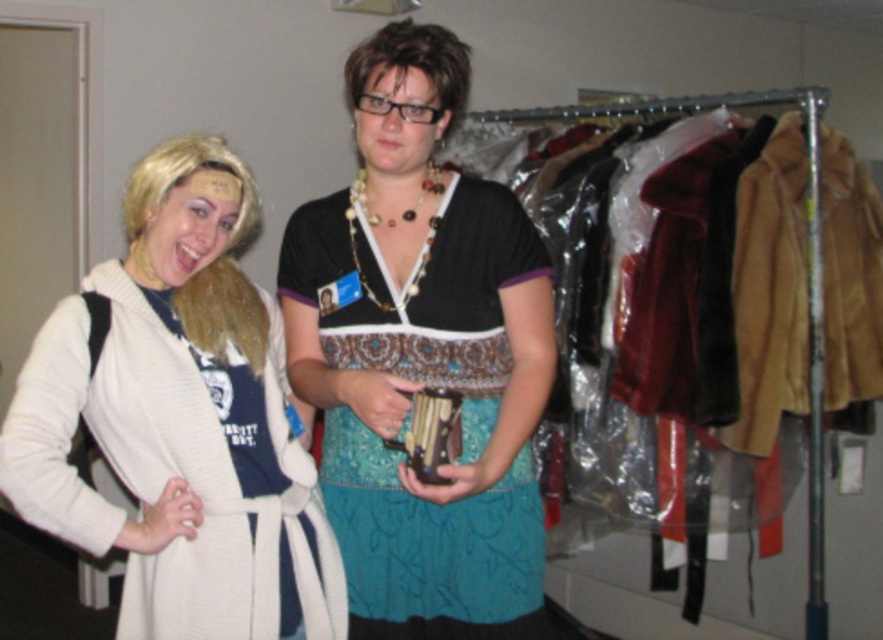
Looking at this image, you are standing in a costume room and need to place a small accessory exactly at the point marked as point (421, 356). According to the image, which object will this accessory be placed on?

The point (421, 356) is on the matte black top at center, so the accessory will be placed on the matte black top at center.

You are an interior designer trying to place a new decorative item at coordinate point 0.5, 0.5. The matte black top at center is currently at 0.558, 0.479. Will the new item interfere with the existing one?

The matte black top at center is located at (421,356), which is close to the desired coordinate (441,320). Depending on the size of the new decorative item, there might be interference. However, since the exact dimensions aren not provided, it is recommended to check the distance between the two points before placing the item.

You are trying to decide which clothing item to take with you on a trip. You have a matte black top at center and a white knit sweater at left. Based on their sizes, which one might be more suitable for packing efficiently?

The white knit sweater at left is smaller in size than the matte black top at center, so it might be more suitable for packing efficiently as it takes up less space.